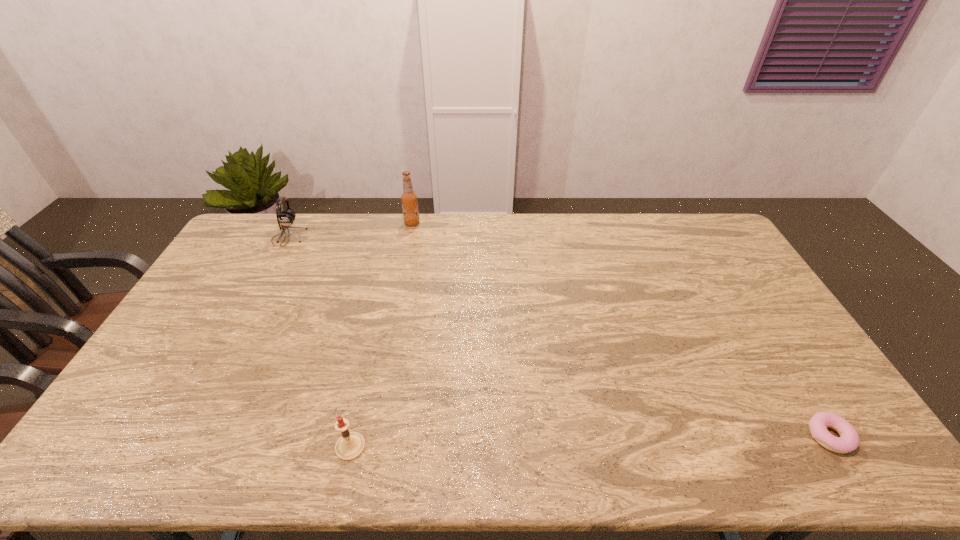
This screenshot has height=540, width=960. I want to click on the farthest object, so click(409, 199).

Locate an element on the screen. Image resolution: width=960 pixels, height=540 pixels. beer bottle is located at coordinates (409, 199).

Where is `earphone`? The image size is (960, 540). earphone is located at coordinates (286, 217).

This screenshot has width=960, height=540. I want to click on the second farthest object, so click(x=286, y=217).

Locate an element on the screen. the second shortest object is located at coordinates (350, 445).

At what (x,y) coordinates should I click in order to perform the action: click on the shortest object. Please return your answer as a coordinate pair (x, y). This screenshot has height=540, width=960. Looking at the image, I should click on (849, 440).

Locate an element on the screen. The height and width of the screenshot is (540, 960). doughnut is located at coordinates (849, 440).

At what (x,y) coordinates should I click in order to perform the action: click on free region located on the front label of the farthest object. Please return your answer as a coordinate pair (x, y). The image size is (960, 540). Looking at the image, I should click on (491, 223).

The width and height of the screenshot is (960, 540). Identify the location of vacant space located 0.110m on the left of the earphone. [x=244, y=238].

At what (x,y) coordinates should I click in order to perform the action: click on vacant region located 0.280m on the right of the second shortest object. Please return your answer as a coordinate pair (x, y). Looking at the image, I should click on (481, 447).